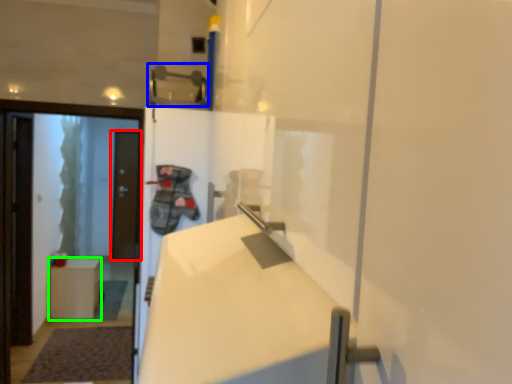
Question: Which object is positioned farthest from door (highlighted by a red box)? Select from door handle (highlighted by a blue box) and furniture (highlighted by a green box).

Choices:
 (A) door handle
 (B) furniture

Answer: (A)